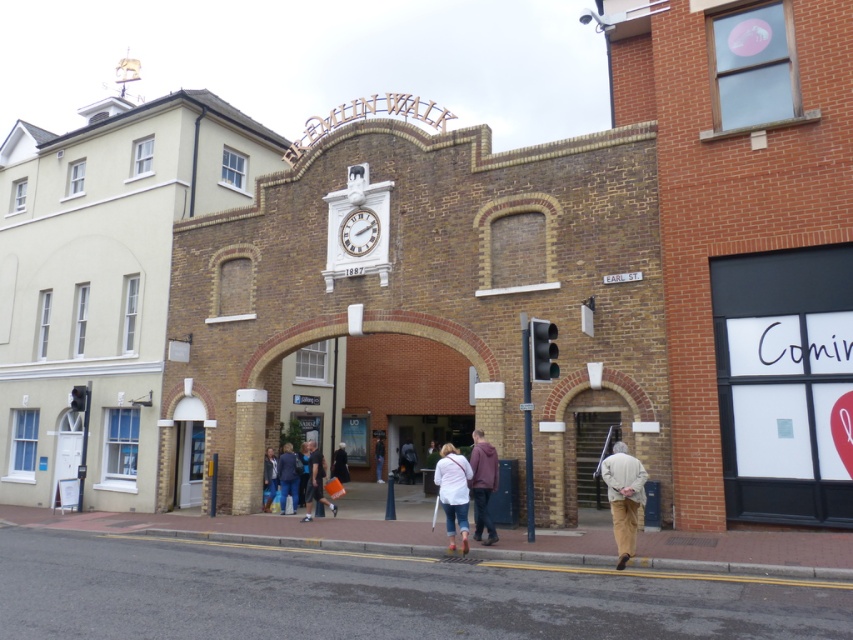
You are a tailor observing two jackets displayed at the center of a historic street scene. Which jacket would require less fabric to make, the white matte jacket at center or the matte black jacket at center?

The white matte jacket at center is smaller than the matte black jacket at center, so it would require less fabric to make.

In the scene shown: You are a tourist visiting the historic Beaulin Walk archway. You notice a white matte jacket at center in the scene. Where exactly is the white matte jacket located relative to the archway?

The white matte jacket at center is located at point coordinates of (x=453, y=492) relative to the archway.

In the scene shown: You are standing in front of the historic brick archway labeled BEAULIN WALK. You want to take a photo of the point at coordinates point (281,481). Is this point within your camera frame if your camera has a focal length of 50mm and a sensor size of 24mm x 36mm?

The point at coordinates point (281,481) is 17.08 meters away from the camera. Using the camera specifications, the field of view can be calculated. With a 50mm lens and 24mm sensor height, the vertical field of view is approximately 27 degrees. At 17.08 meters, the maximum distance covered vertically would be around 8 meters. Since the point is within this range, it should be within the camera frame.